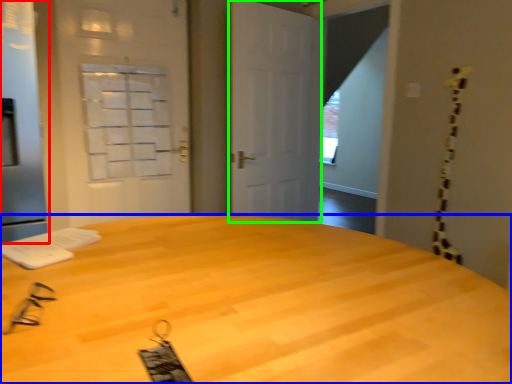
Question: Estimate the real-world distances between objects in this image. Which object is farther from screen door (highlighted by a red box), desk (highlighted by a blue box) or door (highlighted by a green box)?

Choices:
 (A) desk
 (B) door

Answer: (B)